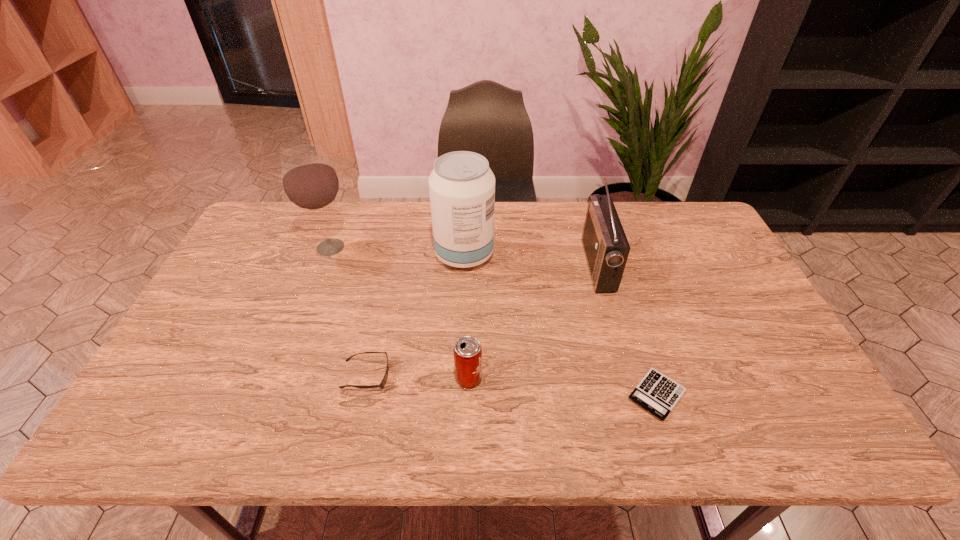
In the image, there is a desktop. Where is `blank space at the right edge`? blank space at the right edge is located at coordinates (720, 323).

Find the location of a particular element. Image resolution: width=960 pixels, height=540 pixels. free space at the near left corner is located at coordinates (183, 429).

The height and width of the screenshot is (540, 960). I want to click on free space at the far right corner of the desktop, so (685, 218).

Identify the location of free area in between the leftmost object and the fourth tallest object. The width and height of the screenshot is (960, 540). (399, 313).

This screenshot has width=960, height=540. Find the location of `free spot between the third shortest object and the second object from left to right`. free spot between the third shortest object and the second object from left to right is located at coordinates (418, 377).

The width and height of the screenshot is (960, 540). What are the coordinates of `free spot between the left alcohol and the second shortest object` in the screenshot? It's located at (348, 311).

Identify the location of free space between the fourth shortest object and the fourth tallest object. The width and height of the screenshot is (960, 540). (533, 322).

Image resolution: width=960 pixels, height=540 pixels. In order to click on free space that is in between the right alcohol and the radio receiver in this screenshot , I will do `click(531, 260)`.

At what (x,y) coordinates should I click in order to perform the action: click on vacant region between the right alcohol and the fourth tallest object. Please return your answer as a coordinate pair (x, y). Looking at the image, I should click on (467, 316).

Locate an element on the screen. free space between the calculator and the right alcohol is located at coordinates (561, 325).